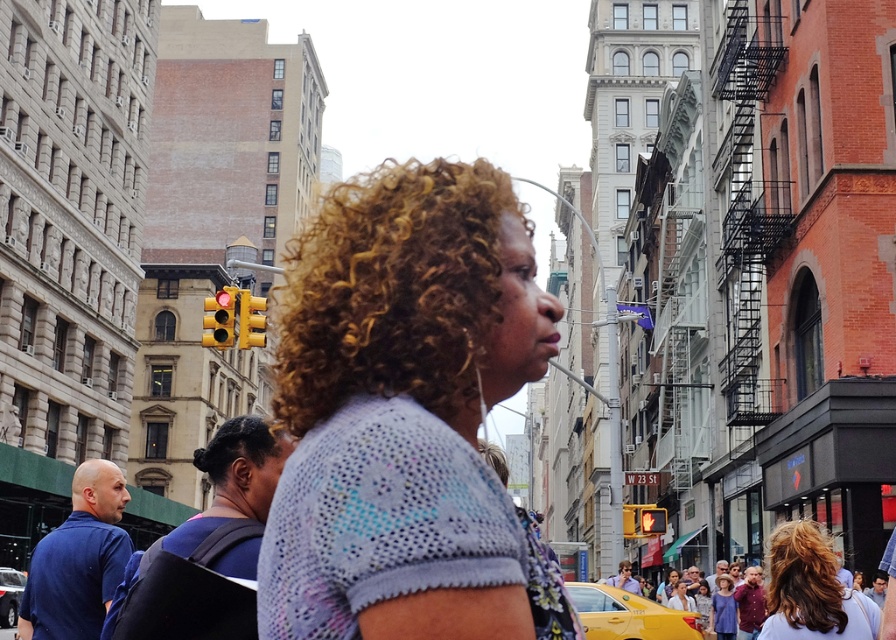
Is yellow matte taxi at lower center bigger than curly blonde hair at center?

No, yellow matte taxi at lower center is not bigger than curly blonde hair at center.

Consider the image. Between yellow matte taxi at lower center and curly blonde hair at center, which one has less height?

With less height is yellow matte taxi at lower center.

What do you see at coordinates (627, 614) in the screenshot?
I see `yellow matte taxi at lower center` at bounding box center [627, 614].

Locate an element on the screen. The width and height of the screenshot is (896, 640). yellow matte taxi at lower center is located at coordinates (627, 614).

Which of these two, black curly hair at center or curly blonde hair at center, stands shorter?

curly blonde hair at center is shorter.

Based on the photo, who is lower down, black curly hair at center or curly blonde hair at center?

Positioned lower is black curly hair at center.

The width and height of the screenshot is (896, 640). Identify the location of black curly hair at center. (237, 445).

This screenshot has height=640, width=896. In order to click on black curly hair at center in this screenshot , I will do `click(237, 445)`.

Locate an element on the screen. The image size is (896, 640). curly golden hair at center is located at coordinates (392, 291).

Between curly golden hair at center and yellow matte taxi at lower center, which one has less height?

Standing shorter between the two is yellow matte taxi at lower center.

This screenshot has height=640, width=896. What do you see at coordinates (392, 291) in the screenshot? I see `curly golden hair at center` at bounding box center [392, 291].

Where is `curly golden hair at center`? curly golden hair at center is located at coordinates (392, 291).